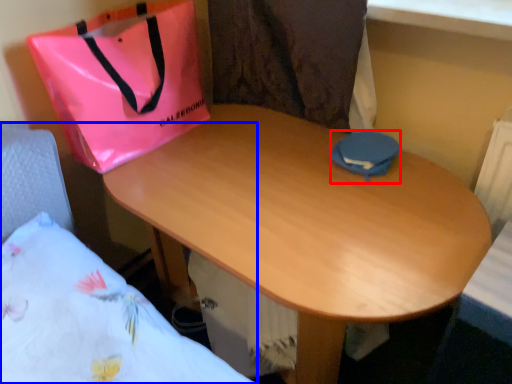
Question: Which object appears closest to the camera in this image, pouch (highlighted by a red box) or bed (highlighted by a blue box)?

Choices:
 (A) pouch
 (B) bed

Answer: (B)